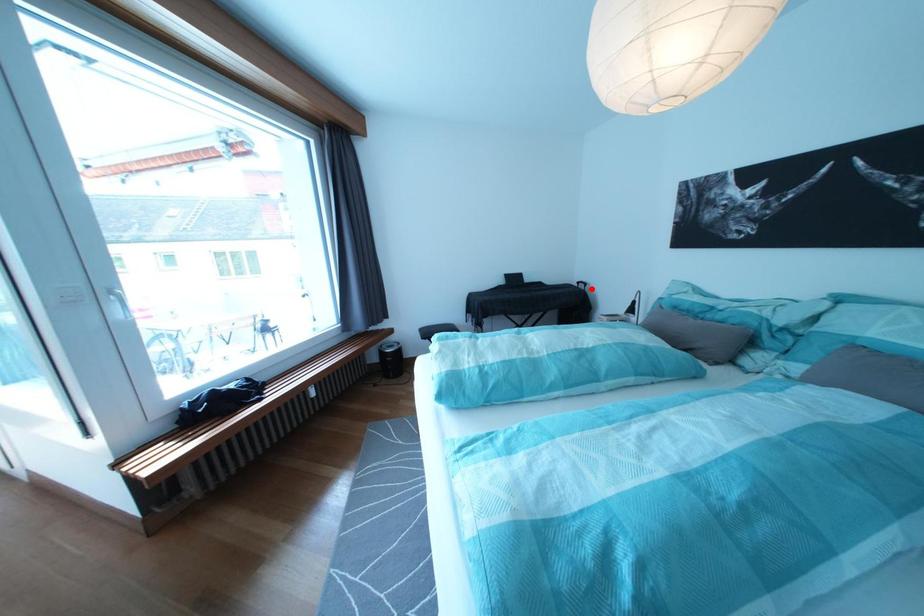
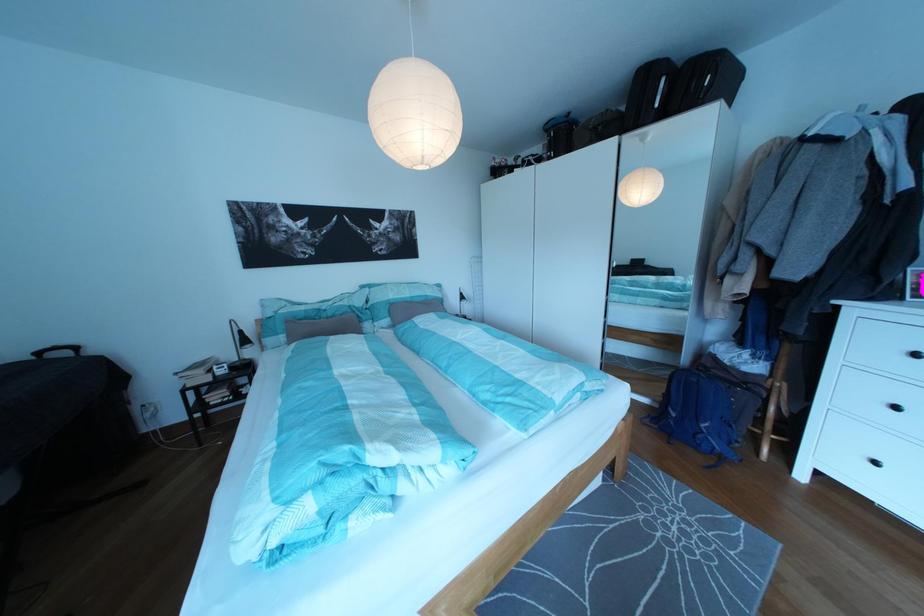
Question: I am providing you with two images of the same scene from different viewpoints. A red point is marked on the first image. Can you still see the location of the red point in image 2?

Choices:
 (A) Yes
 (B) No

Answer: (A)